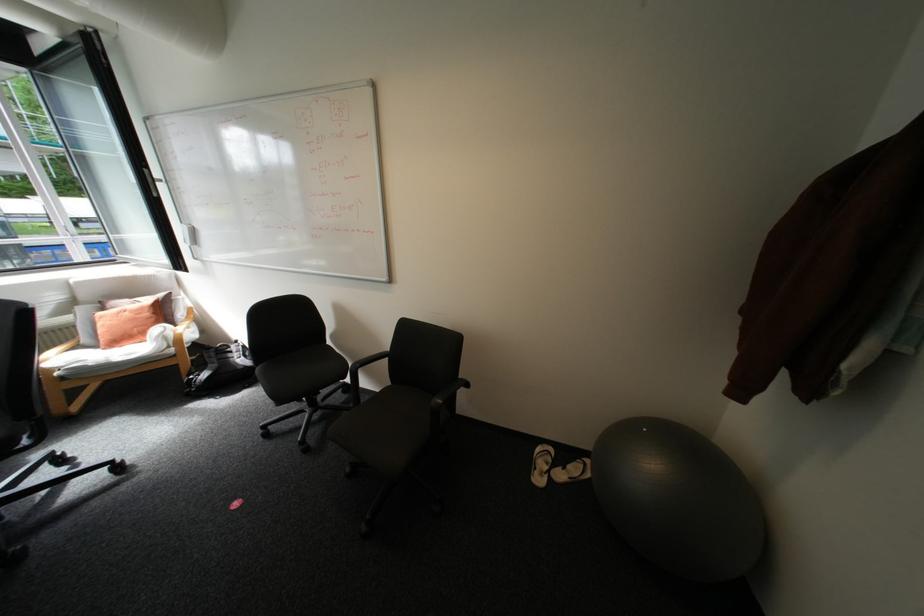
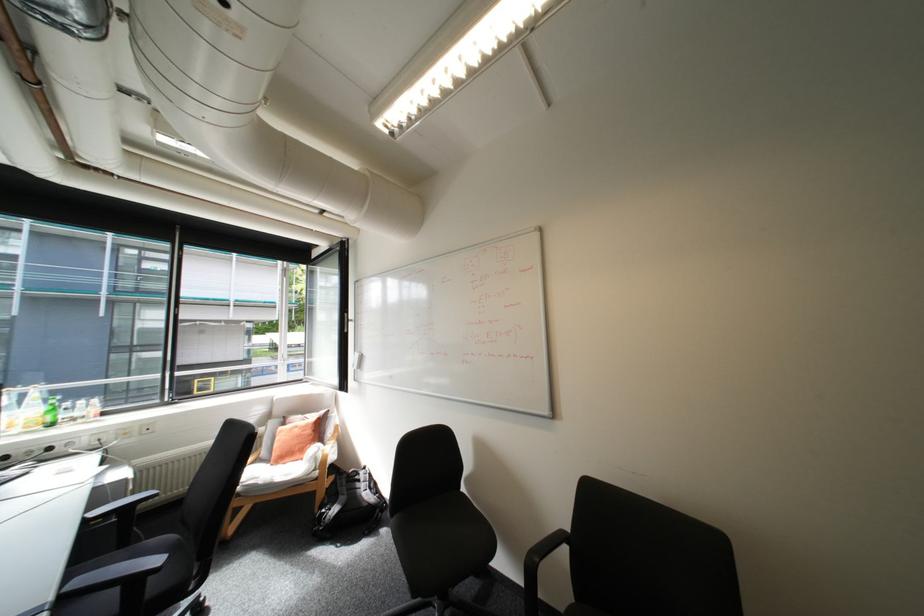
In the second image, find the point that corresponds to (x=137, y=313) in the first image.

(307, 429)